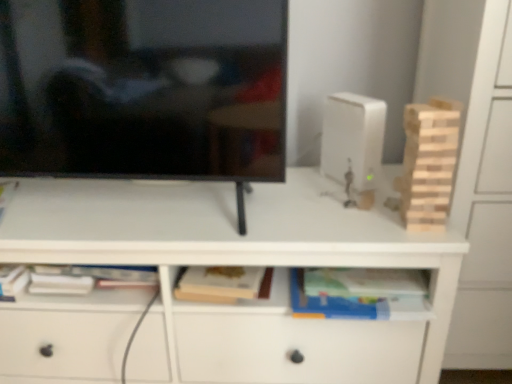
In order to click on vacant space situated on the left part of light wood block tower at right in this screenshot , I will do `click(351, 226)`.